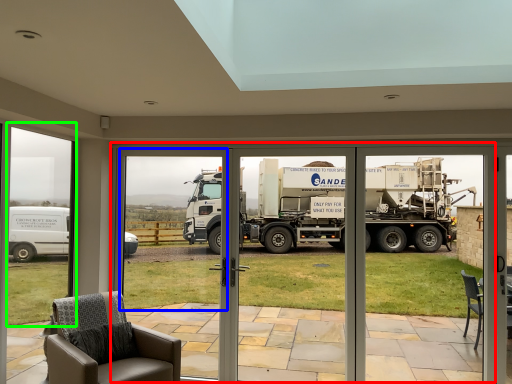
Question: Which is nearer to the garage door (highlighted by a red box)? window screen (highlighted by a blue box) or window frame (highlighted by a green box).

Choices:
 (A) window screen
 (B) window frame

Answer: (A)